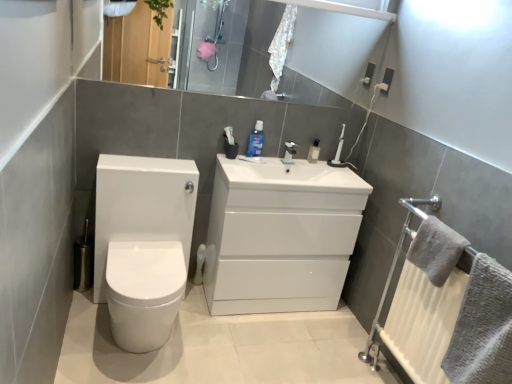
Locate an element on the screen. This screenshot has height=384, width=512. vacant space to the right of matte silver faucet at upper center is located at coordinates (304, 157).